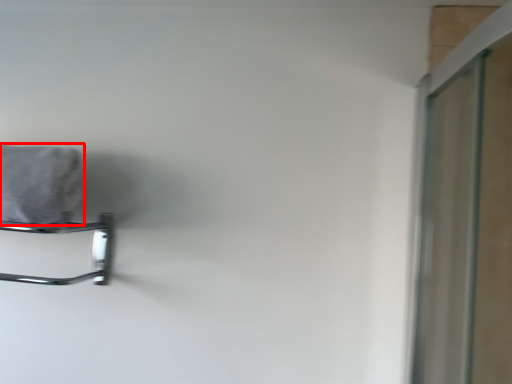
Question: From the image's perspective, where is bath towel (annotated by the red box) located relative to towel rack?

Choices:
 (A) above
 (B) below

Answer: (A)